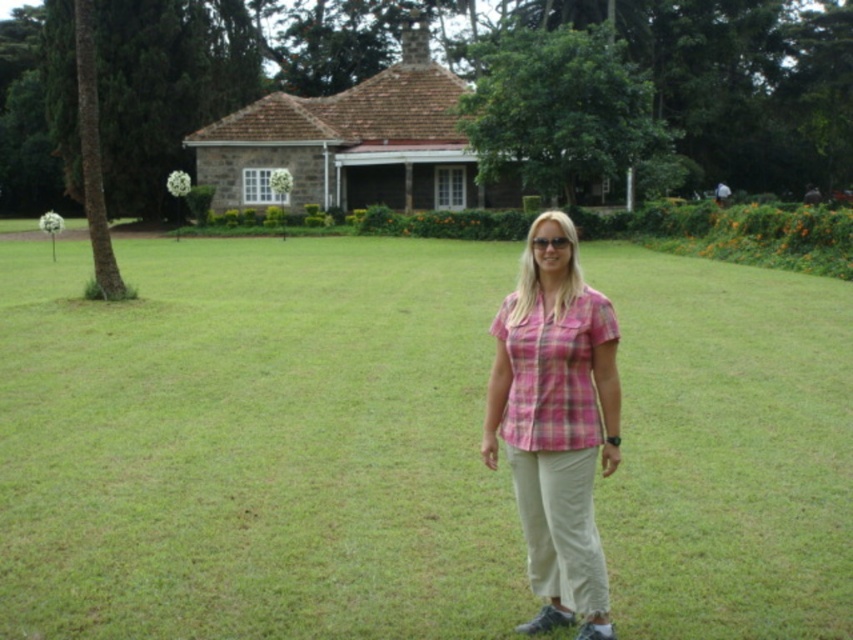
Can you confirm if green grass at center is positioned above pink plaid shirt at center?

Indeed, green grass at center is positioned over pink plaid shirt at center.

Between point (4, 548) and point (505, 324), which one is positioned behind?

The point (4, 548) is more distant.

The image size is (853, 640). What are the coordinates of `green grass at center` in the screenshot? It's located at (x=254, y=444).